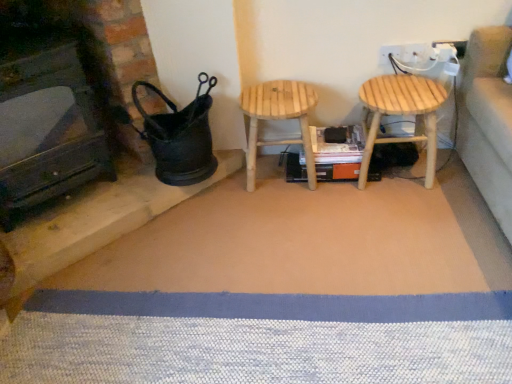
Question: Is natural wood stool at center, which is counted as the 2th stool, starting from the right, facing away from natural wood stool at right, acting as the 1th stool starting from the right?

Choices:
 (A) no
 (B) yes

Answer: (A)

Question: Could you tell me if natural wood stool at center, marked as the 1th stool in a left-to-right arrangement, is turned towards natural wood stool at right, acting as the 1th stool starting from the right?

Choices:
 (A) no
 (B) yes

Answer: (A)

Question: Is natural wood stool at center, which is counted as the 2th stool, starting from the right, smaller than natural wood stool at right, arranged as the second stool when viewed from the left?

Choices:
 (A) no
 (B) yes

Answer: (B)

Question: Does natural wood stool at center, which is counted as the 2th stool, starting from the right, come behind natural wood stool at right, arranged as the second stool when viewed from the left?

Choices:
 (A) no
 (B) yes

Answer: (B)

Question: Can you confirm if natural wood stool at center, marked as the 1th stool in a left-to-right arrangement, is positioned to the left of natural wood stool at right, arranged as the second stool when viewed from the left?

Choices:
 (A) no
 (B) yes

Answer: (B)

Question: Is natural wood stool at center, which is counted as the 2th stool, starting from the right, far from natural wood stool at right, acting as the 1th stool starting from the right?

Choices:
 (A) no
 (B) yes

Answer: (A)

Question: Is natural wood stool at right, arranged as the second stool when viewed from the left, not inside black matte fireplace at left?

Choices:
 (A) yes
 (B) no

Answer: (A)

Question: Could you tell me if natural wood stool at right, arranged as the second stool when viewed from the left, is turned towards black matte fireplace at left?

Choices:
 (A) yes
 (B) no

Answer: (B)

Question: From a real-world perspective, is natural wood stool at right, acting as the 1th stool starting from the right, positioned over black matte fireplace at left based on gravity?

Choices:
 (A) yes
 (B) no

Answer: (B)

Question: Does natural wood stool at right, acting as the 1th stool starting from the right, touch black matte fireplace at left?

Choices:
 (A) yes
 (B) no

Answer: (B)

Question: Is the position of natural wood stool at right, acting as the 1th stool starting from the right, more distant than that of black matte fireplace at left?

Choices:
 (A) yes
 (B) no

Answer: (A)

Question: Is natural wood stool at right, acting as the 1th stool starting from the right, far away from black matte fireplace at left?

Choices:
 (A) no
 (B) yes

Answer: (B)

Question: Does natural wood stool at center, marked as the 1th stool in a left-to-right arrangement, have a lesser width compared to black matte fireplace at left?

Choices:
 (A) no
 (B) yes

Answer: (B)